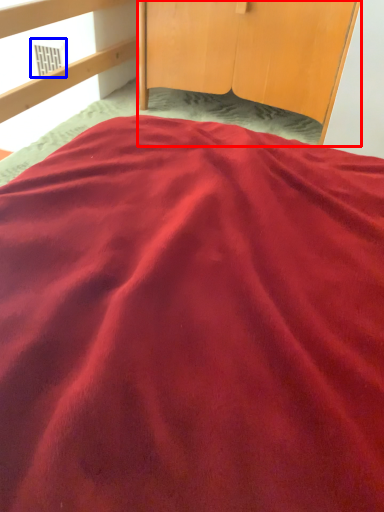
Question: Among these objects, which one is farthest to the camera, furniture (highlighted by a red box) or window (highlighted by a blue box)?

Choices:
 (A) furniture
 (B) window

Answer: (B)